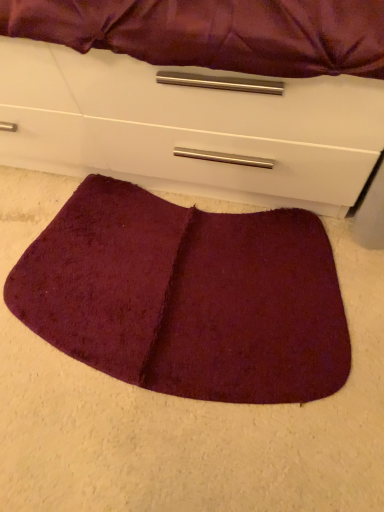
Where is `free location above burgundy plush mat at lower center (from a real-world perspective)`? free location above burgundy plush mat at lower center (from a real-world perspective) is located at coordinates (194, 296).